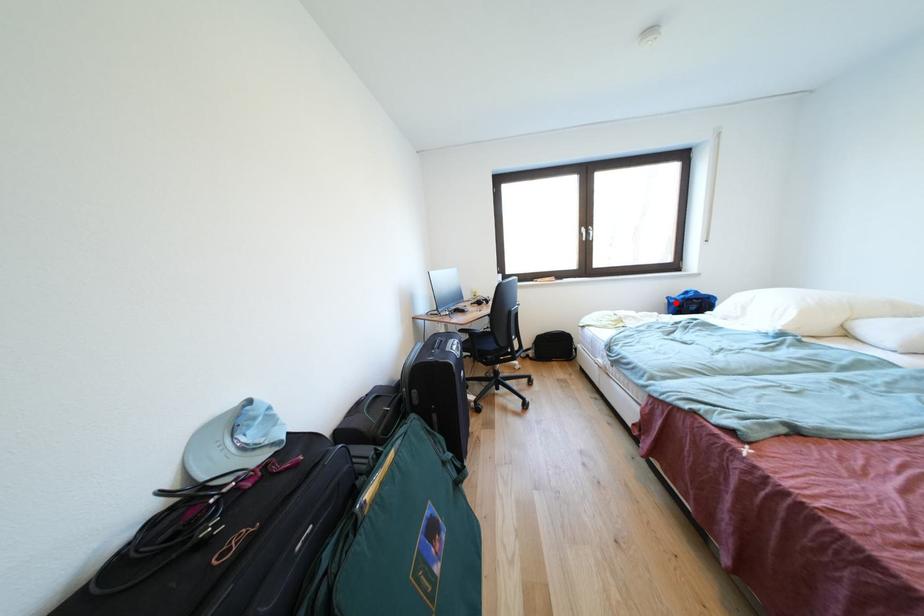
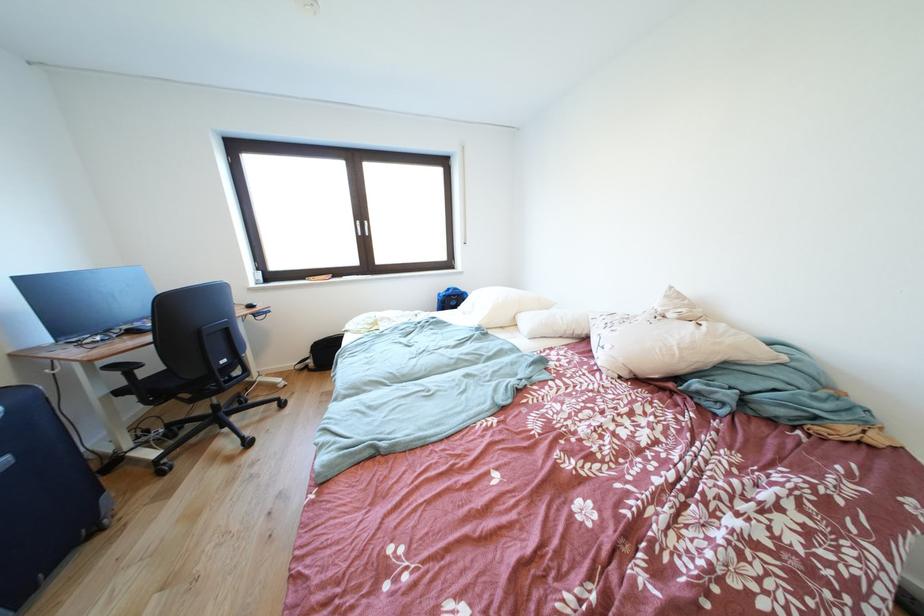
Locate, in the second image, the point that corresponds to the highlighted location in the first image.

(447, 299)